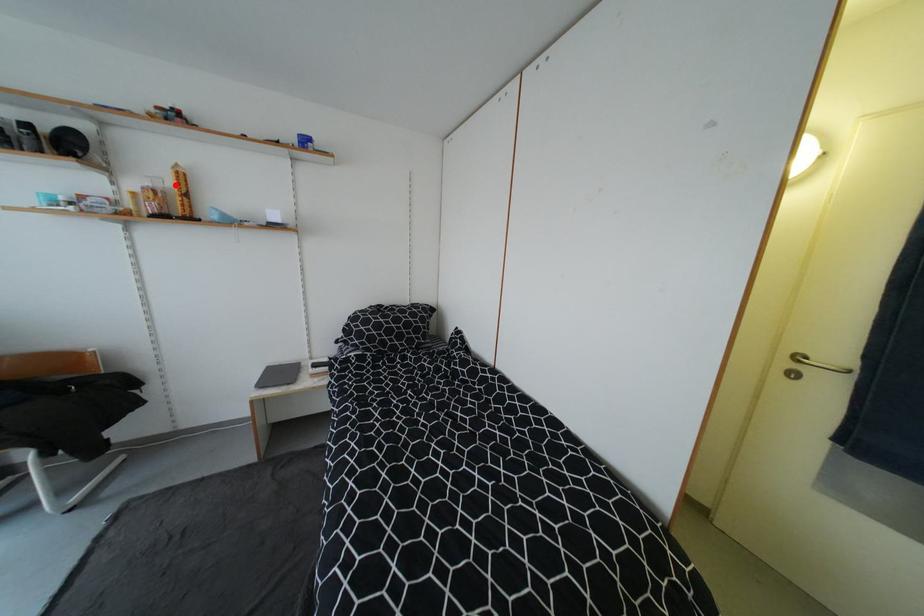
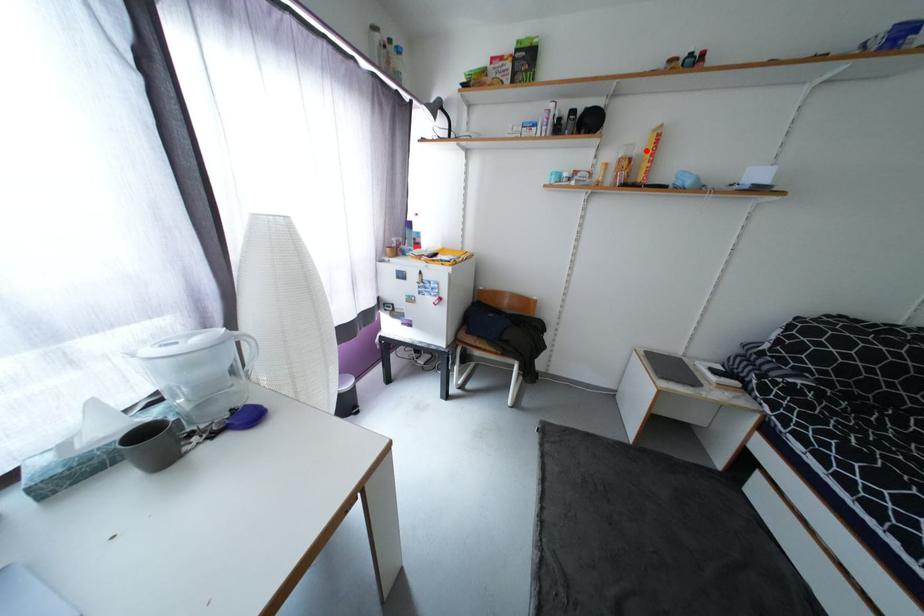
I am providing you with two images of the same scene from different viewpoints. A red point is marked on the first image and another point is marked on the second image. Is the red point in image1 aligned with the point shown in image2?

Yes